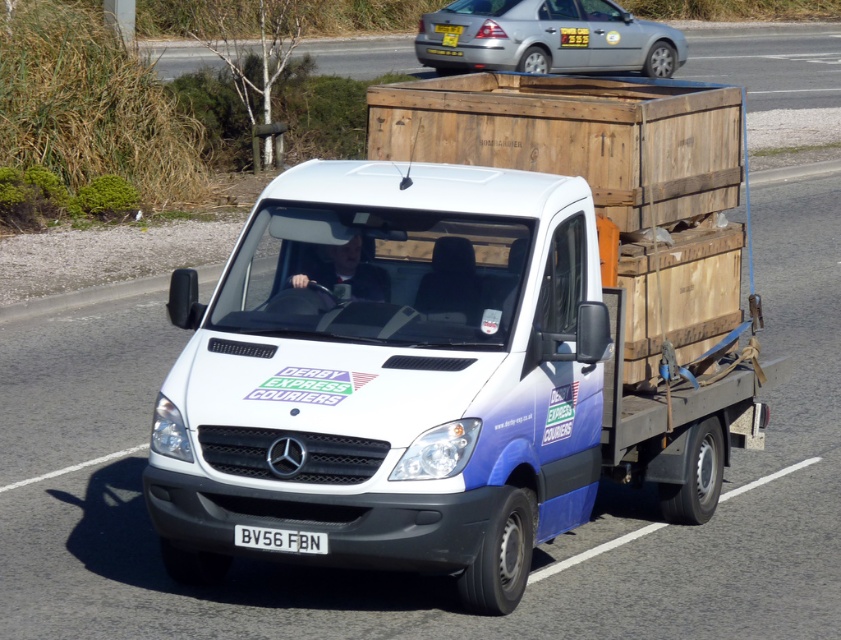
You are a traffic officer observing a scene where a silver metallic sedan at upper center and a white plastic license plate at center are visible. Which object is taller?

The silver metallic sedan at upper center is taller than the white plastic license plate at center.

You are a traffic officer observing the road. You see a white matte van at center and a silver metallic sedan at upper center. Which vehicle is taller?

The white matte van at center is much taller than the silver metallic sedan at upper center.